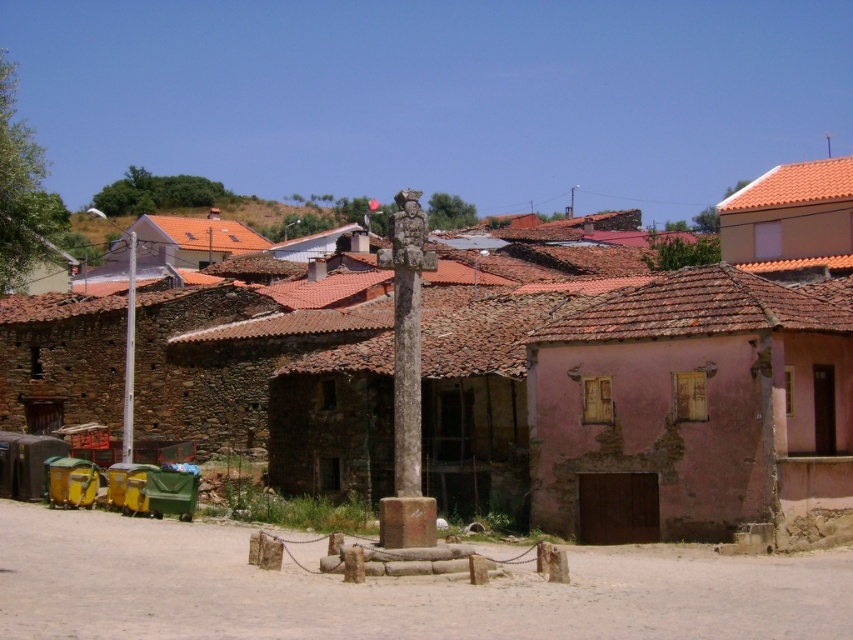
You are standing in the village square and want to place a new bench between the stone cross at center and the white stone pillar at center. Which object should the bench be closer to if it needs to be placed 2 meters away from the closer one?

The stone cross at center is closer to the viewer than the white stone pillar at center, so the bench should be placed 2 meters away from the stone cross at center towards the white stone pillar at center.

You are a tourist standing in the village square and notice both the stone cross at center and the white stone pillar at center. According to the scene, which object is placed above the other?

The stone cross at center is positioned over the white stone pillar at center, so the stone cross is above the pillar.